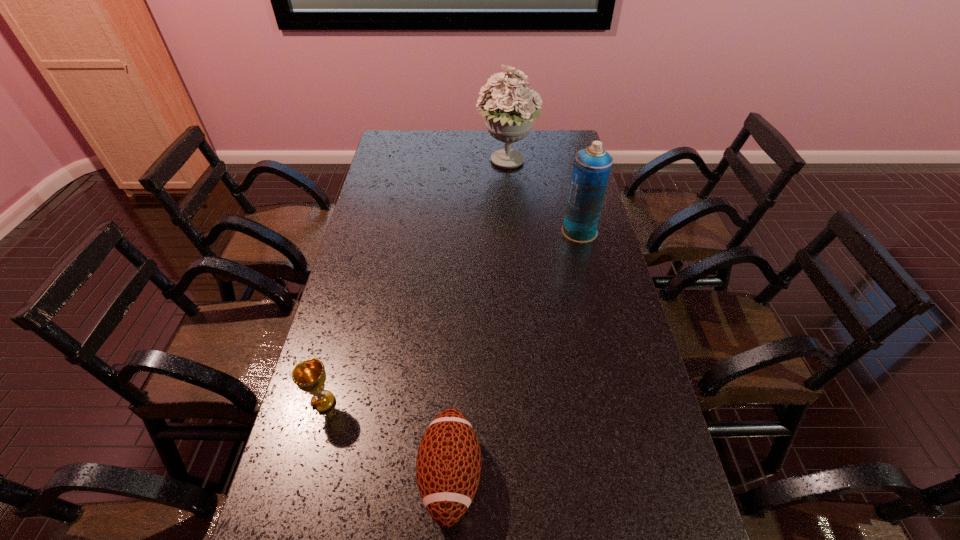
Where is `bouquet`? Image resolution: width=960 pixels, height=540 pixels. bouquet is located at coordinates (509, 118).

Identify the location of the third shortest object. The image size is (960, 540). (591, 168).

The height and width of the screenshot is (540, 960). Find the location of `the second farthest object`. the second farthest object is located at coordinates (591, 168).

Locate an element on the screen. This screenshot has width=960, height=540. the third farthest object is located at coordinates (309, 376).

The image size is (960, 540). Find the location of `chalice`. chalice is located at coordinates (309, 376).

Identify the location of the nearest object. (448, 467).

Identify the location of free location located on the back of the farthest object. This screenshot has height=540, width=960. (505, 140).

Identify the location of free space located 0.290m on the left of the aerosol can. (480, 232).

I want to click on free space located on the back of the chalice, so click(351, 296).

What are the coordinates of `vacant space located on the back of the football` in the screenshot? It's located at (457, 330).